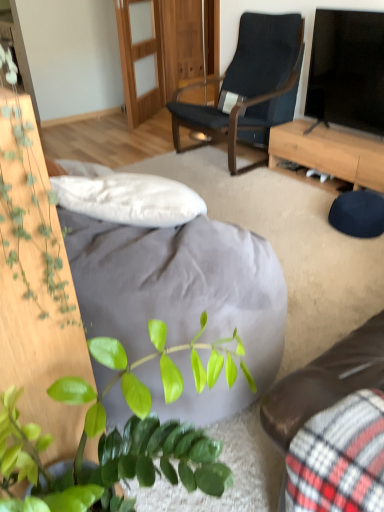
Question: Based on their sizes in the image, would you say green leafy plant at left is bigger or smaller than light brown wood desk at center right?

Choices:
 (A) small
 (B) big

Answer: (A)

Question: Considering the positions of green leafy plant at left and light brown wood desk at center right in the image, is green leafy plant at left wider or thinner than light brown wood desk at center right?

Choices:
 (A) thin
 (B) wide

Answer: (A)

Question: Which is nearer to the light brown wood desk at center right?

Choices:
 (A) green leafy plant at left
 (B) black glossy tv at upper right
 (C) dark blue fabric chair at upper center
 (D) green matte plant at lower left
 (E) velvet plaid studio couch at lower right

Answer: (B)

Question: Considering the real-world distances, which object is farthest from the green leafy plant at left?

Choices:
 (A) velvet plaid studio couch at lower right
 (B) dark blue fabric chair at upper center
 (C) green matte plant at lower left
 (D) black glossy tv at upper right
 (E) light brown wood desk at center right

Answer: (B)